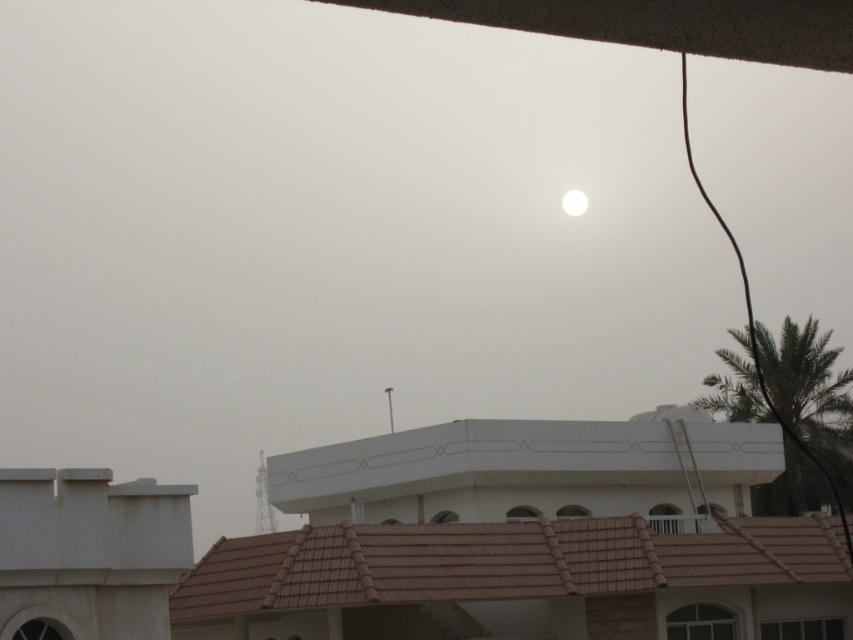
You are an astronomer observing the sky and notice the green leafy palm tree at upper right and the white glossy moon at upper center. Which object would appear larger in the sky?

The green leafy palm tree at upper right is closer to the viewer than the white glossy moon at upper center, so it would appear larger in the sky.

You are an astronomer observing the sky and notice the green leafy palm tree at upper right and the white glossy moon at upper center. Which object appears taller in the scene?

The green leafy palm tree at upper right appears taller than the white glossy moon at upper center in the scene.

You are standing in the scene and want to move from the point closer to you to the point further away. Which path would you take between the two points, point (x=708, y=401) and point (x=573, y=214)?

You should move from point (x=708, y=401) to point (x=573, y=214) because point (x=708, y=401) is closer to the viewer and the other point is further away.